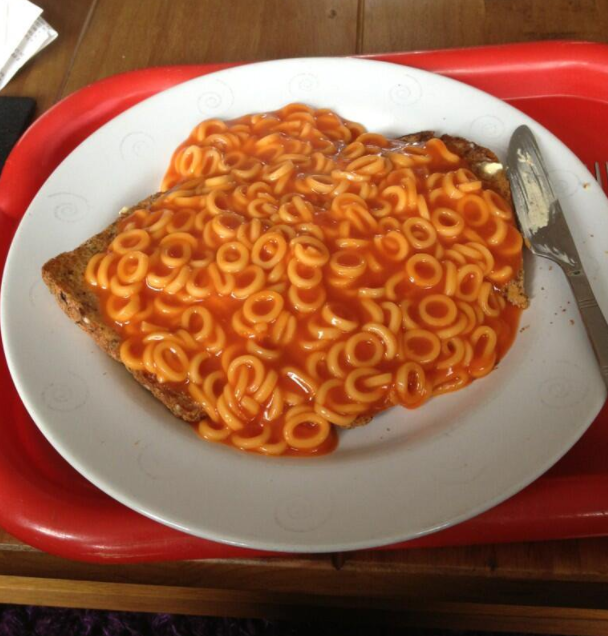
You are a GUI agent. You are given a task and a screenshot of the screen. Output one action in this format:
    pyautogui.click(x=<x>, y=<y>)
    Task: Click on the red plastic tray
    
    Given the screenshot: What is the action you would take?
    pyautogui.click(x=45, y=515)